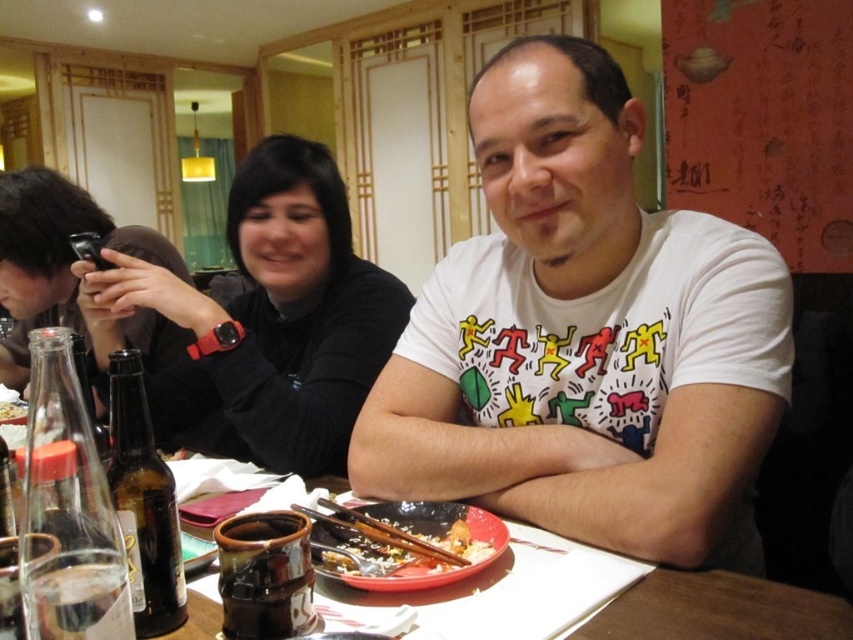
Question: Can you confirm if white cotton t-shirt at center is thinner than brown glass bottle at lower left?

Choices:
 (A) yes
 (B) no

Answer: (B)

Question: Is black matte sweater at upper left positioned behind shiny ceramic bowl at center?

Choices:
 (A) yes
 (B) no

Answer: (A)

Question: Among these points, which one is nearest to the camera?

Choices:
 (A) (521, 212)
 (B) (230, 224)
 (C) (21, 416)
 (D) (367, 547)

Answer: (D)

Question: Considering the real-world distances, which object is farthest from the clear glass bottle at lower left?

Choices:
 (A) shiny ceramic bowl at center
 (B) black matte sweater at upper left

Answer: (B)

Question: Can you confirm if white cotton t-shirt at center is smaller than white rice at center?

Choices:
 (A) no
 (B) yes

Answer: (A)

Question: Based on their relative distances, which object is nearer to the black matte sweater at upper left?

Choices:
 (A) shiny ceramic bowl at center
 (B) brown ceramic plate at center

Answer: (B)